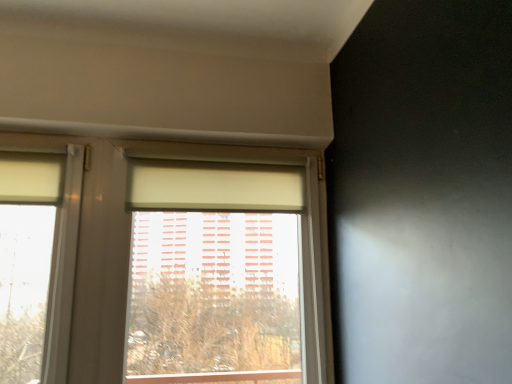
Question: Should I look upward or downward to see matte white window at center?

Choices:
 (A) up
 (B) down

Answer: (B)

Question: Does matte white window at center have a lesser width compared to beige fabric curtain at center?

Choices:
 (A) yes
 (B) no

Answer: (B)

Question: Is matte white window at center not within beige fabric curtain at center?

Choices:
 (A) yes
 (B) no

Answer: (A)

Question: Does matte white window at center have a greater height compared to beige fabric curtain at center?

Choices:
 (A) no
 (B) yes

Answer: (B)

Question: Is matte white window at center beside beige fabric curtain at center?

Choices:
 (A) yes
 (B) no

Answer: (B)

Question: Considering the relative positions of matte white window at center and beige fabric curtain at center in the image provided, is matte white window at center to the right of beige fabric curtain at center from the viewer's perspective?

Choices:
 (A) yes
 (B) no

Answer: (A)

Question: Can you confirm if matte white window at center is bigger than beige fabric curtain at center?

Choices:
 (A) yes
 (B) no

Answer: (A)

Question: Is beige fabric curtain at center shorter than matte white window at center?

Choices:
 (A) no
 (B) yes

Answer: (B)

Question: Could you tell me if beige fabric curtain at center is turned towards matte white window at center?

Choices:
 (A) no
 (B) yes

Answer: (B)

Question: Is beige fabric curtain at center looking in the opposite direction of matte white window at center?

Choices:
 (A) no
 (B) yes

Answer: (B)

Question: Can you confirm if beige fabric curtain at center is bigger than matte white window at center?

Choices:
 (A) yes
 (B) no

Answer: (B)

Question: From the image's perspective, is beige fabric curtain at center located above matte white window at center?

Choices:
 (A) yes
 (B) no

Answer: (A)

Question: Does beige fabric curtain at center have a lesser width compared to matte white window at center?

Choices:
 (A) no
 (B) yes

Answer: (B)

Question: From the image's perspective, relative to beige fabric curtain at center, is matte white window at center above or below?

Choices:
 (A) above
 (B) below

Answer: (B)